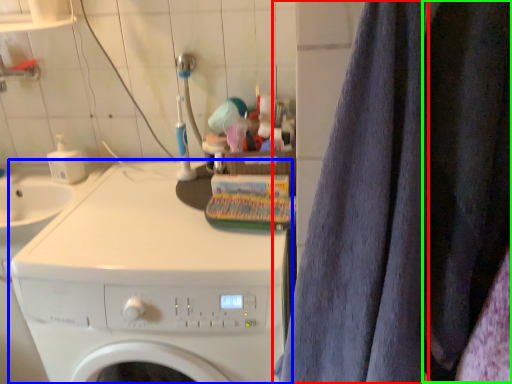
Question: Considering the real-world distances, which object is closest to bath towel (highlighted by a red box)? washing machine (highlighted by a blue box) or clothing (highlighted by a green box).

Choices:
 (A) washing machine
 (B) clothing

Answer: (B)